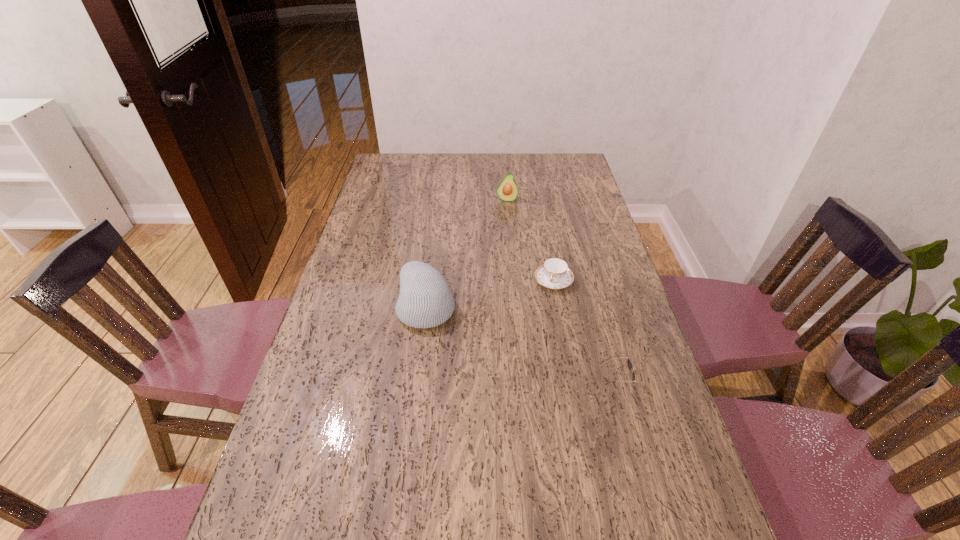
At what (x,y) coordinates should I click in order to perform the action: click on free space located on the side with the handle of the third object from left to right. Please return your answer as a coordinate pair (x, y). Image resolution: width=960 pixels, height=540 pixels. Looking at the image, I should click on (521, 370).

Find the location of a particular element. Image resolution: width=960 pixels, height=540 pixels. vacant space located 0.360m on the cut side of the avocado is located at coordinates [x=502, y=263].

In order to click on free space located 0.280m on the cut side of the avocado in this screenshot , I will do `click(503, 248)`.

Where is `free space located on the cut side of the avocado`? The width and height of the screenshot is (960, 540). free space located on the cut side of the avocado is located at coordinates (505, 224).

The height and width of the screenshot is (540, 960). What are the coordinates of `sunglasses present at the right edge` in the screenshot? It's located at (630, 365).

Find the location of a particular element. The image size is (960, 540). teacup located in the right edge section of the desktop is located at coordinates (554, 273).

Find the location of a particular element. This screenshot has height=540, width=960. free space at the far edge of the desktop is located at coordinates (475, 179).

The width and height of the screenshot is (960, 540). Find the location of `free location at the left edge`. free location at the left edge is located at coordinates (361, 232).

This screenshot has width=960, height=540. In the image, there is a desktop. Find the location of `vacant space at the right edge`. vacant space at the right edge is located at coordinates (617, 423).

This screenshot has height=540, width=960. In the image, there is a desktop. Identify the location of free space at the far left corner. (406, 177).